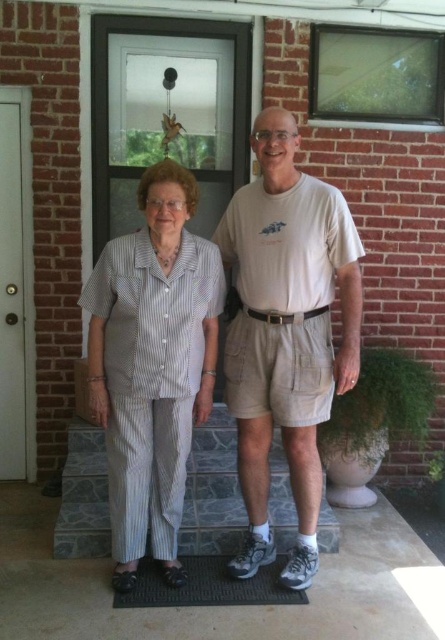
You are standing on the porch and want to place a small potted plant between the two points labeled point (179, 422) and point (179, 596). Which point should the plant be closer to so it is nearer to the camera?

The plant should be placed closer to point (179, 422) because it is further to the camera than point (179, 596).

You are a delivery person trying to reach the door of the brick house. You see the white striped pajamas at center and the stonework at center. Which object is closer to you?

The white striped pajamas at center is closer to you because it is in front of the stonework at center.